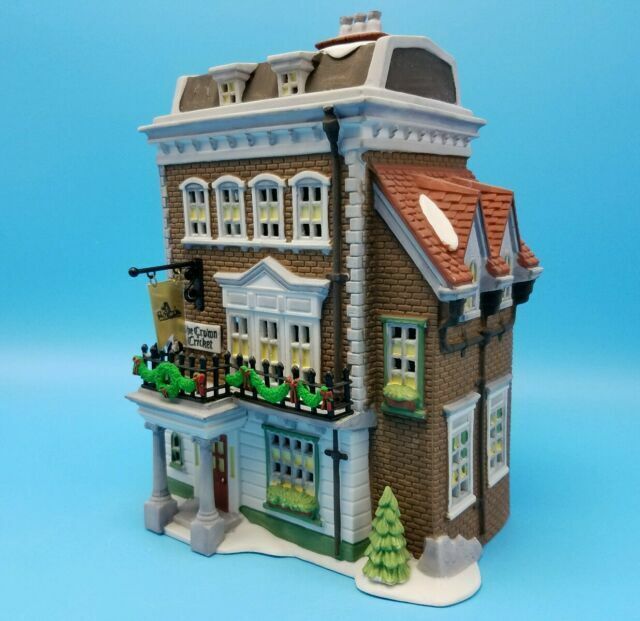
Find the location of `chimney`. chimney is located at coordinates (355, 30).